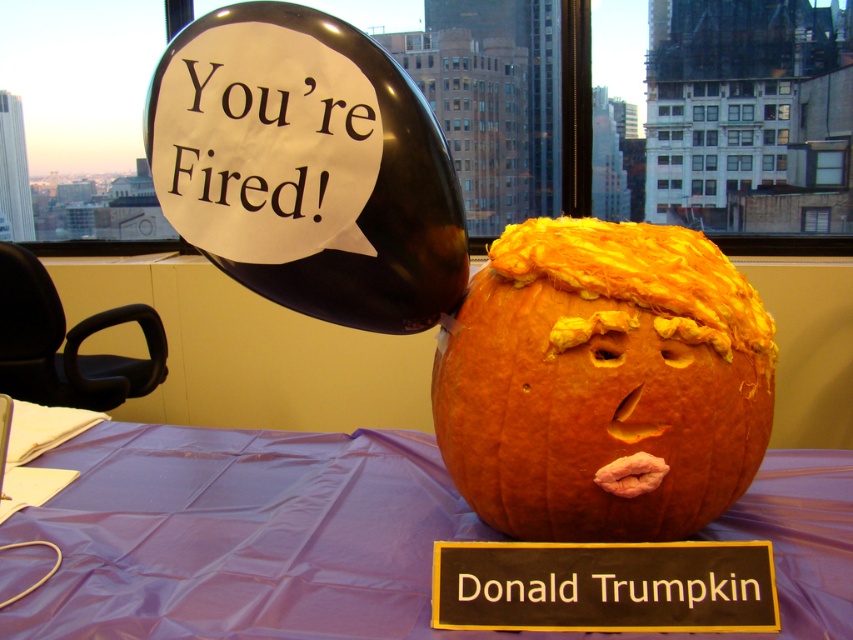
Question: Is orange pumpkin at center positioned behind orange carved pumpkin at center?

Choices:
 (A) no
 (B) yes

Answer: (A)

Question: Which object is positioned closest to the black paper balloon at upper left?

Choices:
 (A) orange carved pumpkin at center
 (B) blackmaterial/texturedonald trumpkin at center

Answer: (A)

Question: Which object is positioned farthest from the white paper at upper center?

Choices:
 (A) black paper balloon at upper left
 (B) orange pumpkin at center
 (C) blackmaterial/texturedonald trumpkin at center
 (D) orange carved pumpkin at center

Answer: (B)

Question: Can you confirm if black paper balloon at upper left is bigger than white paper at upper center?

Choices:
 (A) yes
 (B) no

Answer: (A)

Question: Is orange pumpkin at center bigger than black paper balloon at upper left?

Choices:
 (A) yes
 (B) no

Answer: (A)

Question: Which point is closer to the camera taking this photo?

Choices:
 (A) (329, 81)
 (B) (250, 221)
 (C) (664, 381)

Answer: (A)